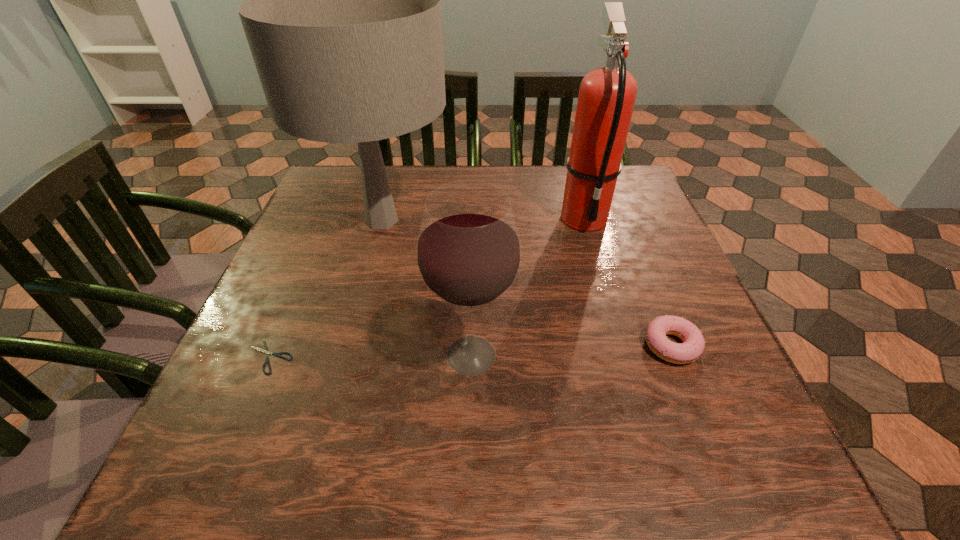
Choose which object is the third nearest neighbor to the fire extinguisher. Please provide its 2D coordinates. Your answer should be formatted as a tuple, i.e. [(x, y)], where the tuple contains the x and y coordinates of a point satisfying the conditions above.

[(468, 254)]

The width and height of the screenshot is (960, 540). I want to click on object that is the nearest to the lampshade, so click(x=468, y=254).

The width and height of the screenshot is (960, 540). In order to click on free location that satisfies the following two spatial constraints: 1. on the front-facing side of the lampshade; 2. on the left side of the third tallest object in this screenshot , I will do `click(346, 355)`.

The height and width of the screenshot is (540, 960). Identify the location of free space that satisfies the following two spatial constraints: 1. on the back side of the shortest object; 2. on the left side of the fourth tallest object. (275, 345).

The width and height of the screenshot is (960, 540). What are the coordinates of `free region that satisfies the following two spatial constraints: 1. on the hose direction of the fire extinguisher; 2. on the front-facing side of the lampshade` in the screenshot? It's located at (585, 221).

Image resolution: width=960 pixels, height=540 pixels. In order to click on vacant position in the image that satisfies the following two spatial constraints: 1. on the hose direction of the fire extinguisher; 2. on the front-facing side of the lampshade in this screenshot , I will do `click(585, 221)`.